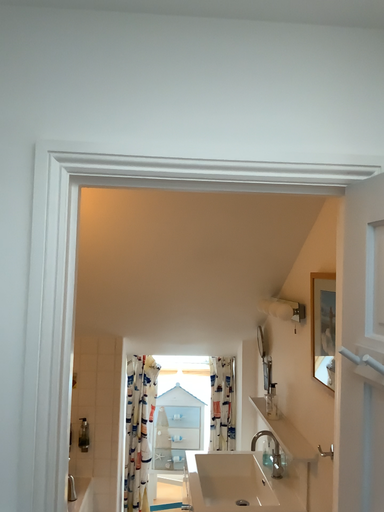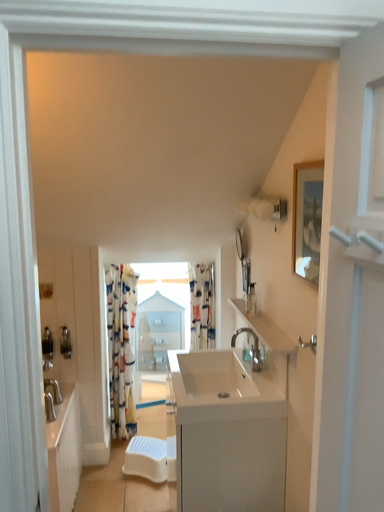
Question: How did the camera likely rotate when shooting the video?

Choices:
 (A) rotated downward
 (B) rotated upward

Answer: (A)